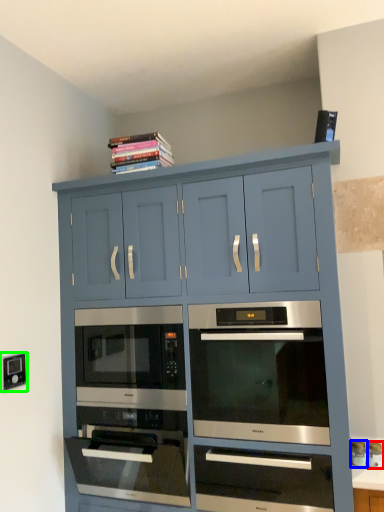
Question: Based on their relative distances, which object is farther from appliance (highlighted by a red box)? Choose from appliance (highlighted by a blue box) and electric outlet (highlighted by a green box).

Choices:
 (A) appliance
 (B) electric outlet

Answer: (B)